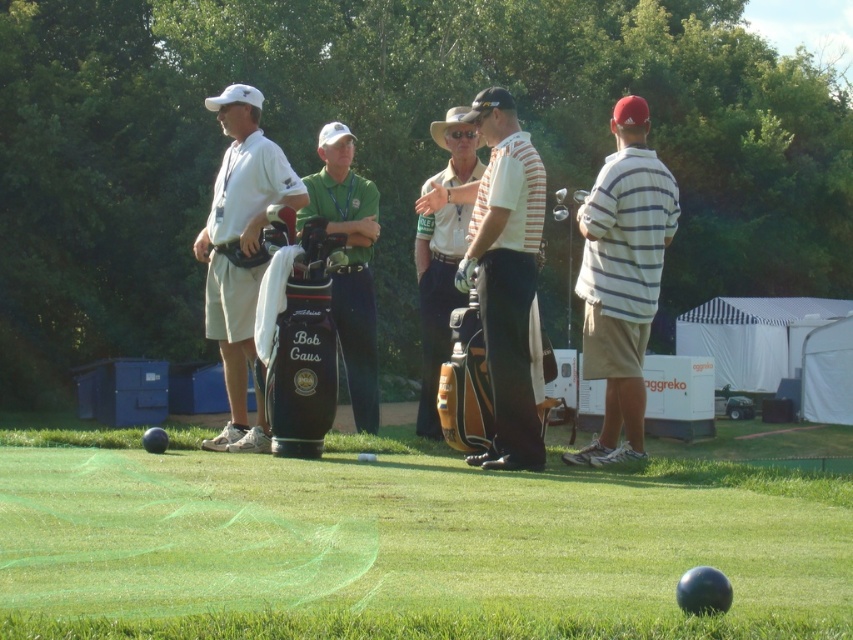
Between striped cotton shirt at right and white matte golf bag at left, which one appears on the right side from the viewer's perspective?

striped cotton shirt at right is more to the right.

Is point (634, 349) behind point (247, 332)?

That is False.

The width and height of the screenshot is (853, 640). What are the coordinates of `striped cotton shirt at right` in the screenshot? It's located at (622, 280).

Can you confirm if smooth green turf at lower center is positioned to the right of green fabric golf bag at center?

Indeed, smooth green turf at lower center is positioned on the right side of green fabric golf bag at center.

Can you confirm if smooth green turf at lower center is shorter than green fabric golf bag at center?

Yes.

Where is `smooth green turf at lower center`? This screenshot has width=853, height=640. smooth green turf at lower center is located at coordinates (409, 547).

Locate an element on the screen. This screenshot has height=640, width=853. smooth green turf at lower center is located at coordinates (409, 547).

Between smooth green turf at lower center and white matte golf bag at left, which one has more height?

With more height is white matte golf bag at left.

Does smooth green turf at lower center have a larger size compared to white matte golf bag at left?

No, smooth green turf at lower center is not bigger than white matte golf bag at left.

Between point (161, 477) and point (251, 148), which one is positioned behind?

The point (251, 148) is more distant.

The height and width of the screenshot is (640, 853). I want to click on smooth green turf at lower center, so pos(409,547).